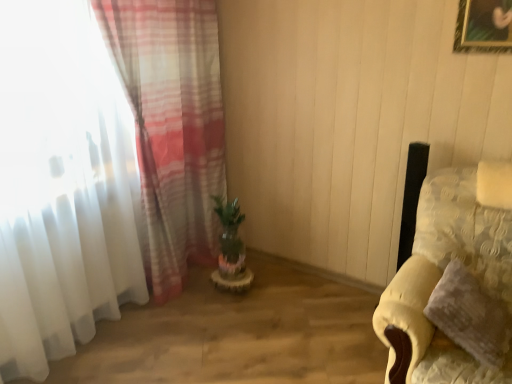
Find the location of a particular element. The height and width of the screenshot is (384, 512). vacant area located to the right-hand side of translucent fabric curtain at left is located at coordinates (227, 306).